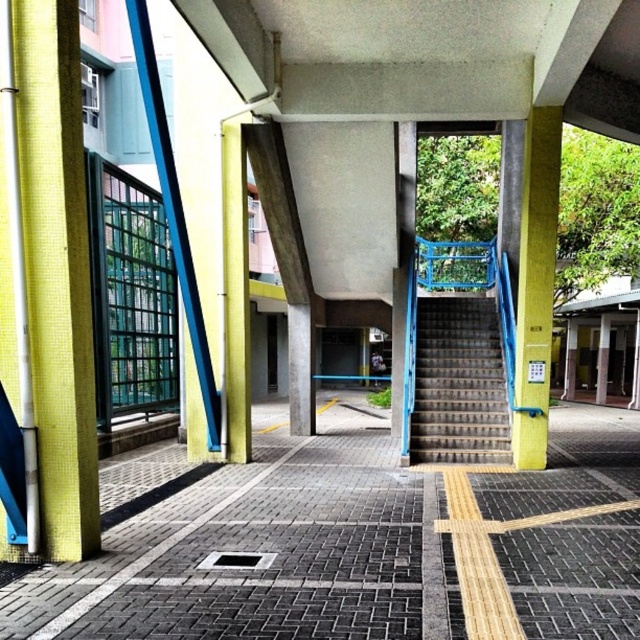
You are a delivery person carrying a large package and need to navigate through the area. The yellow textured pillar at right is blocking your path to the metallic blue staircase at right. Can you move around the pillar to reach the staircase?

The metallic blue staircase at right is bigger than the yellow textured pillar at right, so you can move around the yellow textured pillar at right to reach the staircase since it is smaller in size.

You are standing on the paved area with the yellow line. You need to walk towards the pink building in the background. Which direction should you go first, towards the yellow mosaic tile pillar at left or the yellow mosaic tile pillar at center?

You should go towards the yellow mosaic tile pillar at left first because it is below the yellow mosaic tile pillar at center, meaning it is closer to your current position on the paved area.